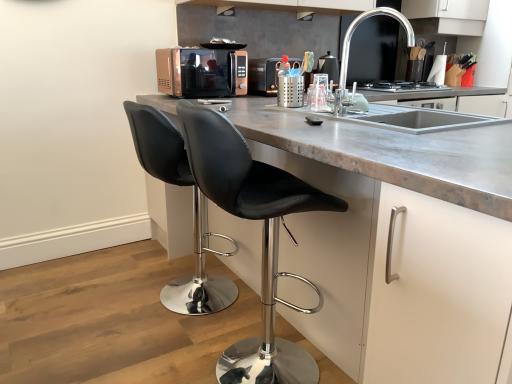
Identify the location of vacant region in front of black leather stool at lower left, the second chair viewed from the front. This screenshot has width=512, height=384. (148, 343).